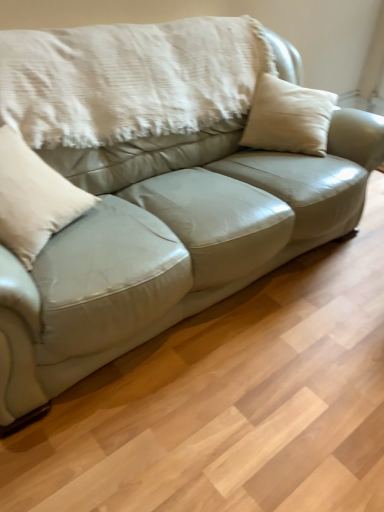
What are the coordinates of `white textured blanket at upper center` in the screenshot? It's located at (129, 79).

What do you see at coordinates (129, 79) in the screenshot?
I see `white textured blanket at upper center` at bounding box center [129, 79].

This screenshot has height=512, width=384. Find the location of `white textured blanket at upper center`. white textured blanket at upper center is located at coordinates (129, 79).